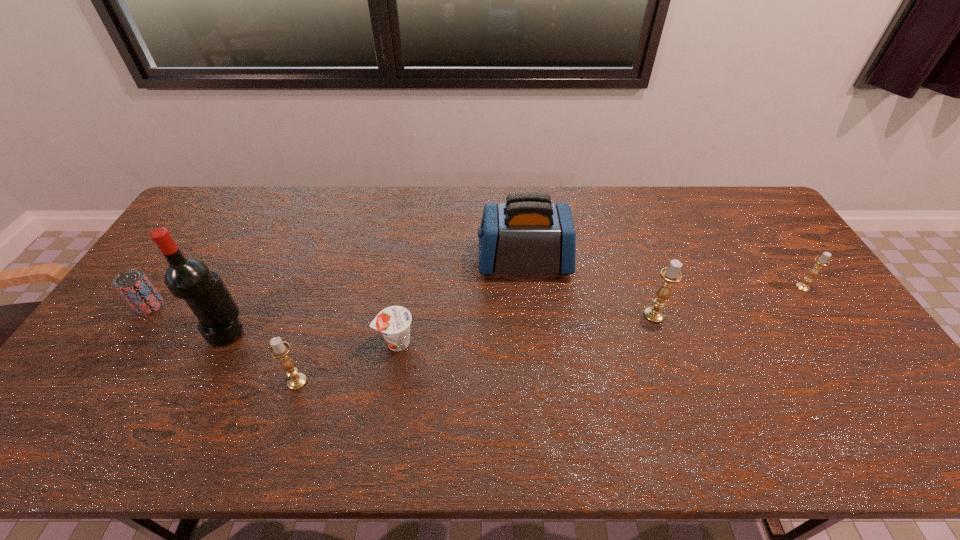
You are a GUI agent. You are given a task and a screenshot of the screen. Output one action in this format:
    pyautogui.click(x=<x>, y=<y>)
    Task: Click on the nearest candle holder
    
    Given the screenshot: What is the action you would take?
    pyautogui.click(x=279, y=349)

You are a GUI agent. You are given a task and a screenshot of the screen. Output one action in this format:
    pyautogui.click(x=<x>, y=<y>)
    Task: Click on the fifth object from right to left
    This screenshot has width=960, height=540.
    Given the screenshot: What is the action you would take?
    pyautogui.click(x=279, y=349)

Where is `the second object from right to left`? This screenshot has height=540, width=960. the second object from right to left is located at coordinates (671, 274).

The width and height of the screenshot is (960, 540). Identify the location of the second candle holder from right to left. (671, 274).

This screenshot has width=960, height=540. What are the coordinates of `the farthest candle holder` in the screenshot? It's located at (821, 261).

Where is `the rightmost candle holder`? The height and width of the screenshot is (540, 960). the rightmost candle holder is located at coordinates (821, 261).

Image resolution: width=960 pixels, height=540 pixels. What are the coordinates of `wine bottle` in the screenshot? It's located at (190, 279).

The height and width of the screenshot is (540, 960). Find the location of `the tallest object`. the tallest object is located at coordinates click(x=190, y=279).

Find the location of `the leftmost object`. the leftmost object is located at coordinates (133, 285).

The width and height of the screenshot is (960, 540). What are the coordinates of `beer can` in the screenshot? It's located at (133, 285).